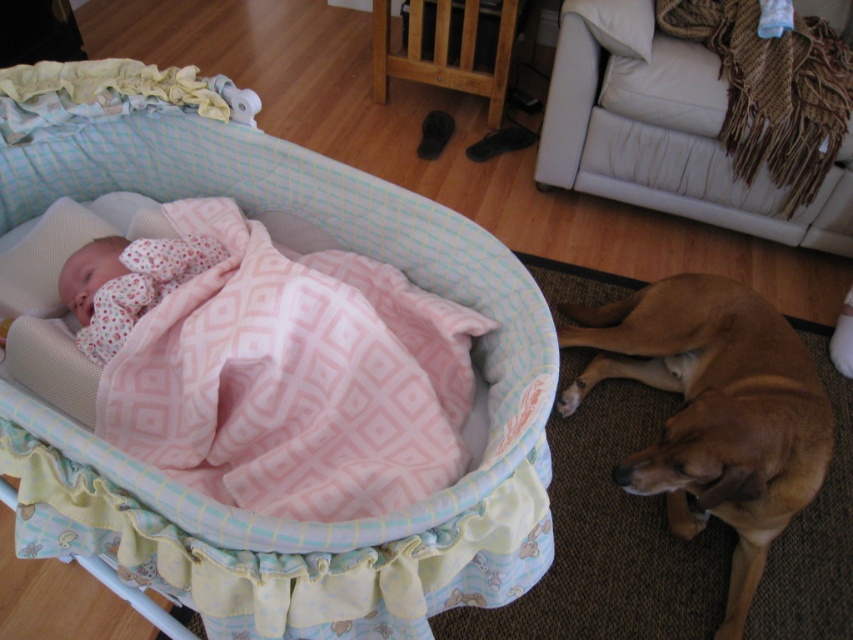
You are a parent looking at the baby in the fluffy pink blanket at center. Where is the brown smooth dog at lower right located relative to the blanket?

The brown smooth dog at lower right is located to the right of the fluffy pink blanket at center.

You are a parent checking on your baby. You see the brown smooth dog at lower right and the fluffy pink blanket at center. Which object is nearer to you?

The brown smooth dog at lower right is closer to the viewer than the fluffy pink blanket at center.